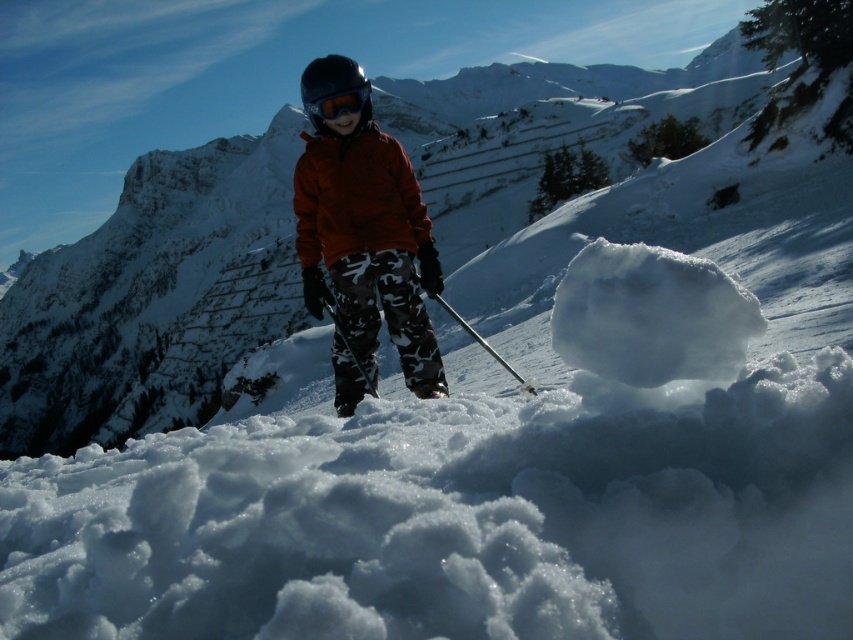
Based on the photo, does matte black goggles at center have a lesser width compared to metallic ski pole at center?

No.

Is point (334, 96) positioned in front of point (521, 381)?

Yes, point (334, 96) is in front of point (521, 381).

This screenshot has height=640, width=853. Find the location of `matte black goggles at center`. matte black goggles at center is located at coordinates (334, 99).

Does orange softshell jacket at center have a larger size compared to metallic ski pole at center?

Indeed, orange softshell jacket at center has a larger size compared to metallic ski pole at center.

Who is shorter, orange softshell jacket at center or metallic ski pole at center?

metallic ski pole at center

Is point (399, 252) farther from camera compared to point (498, 355)?

No, it is not.

Image resolution: width=853 pixels, height=640 pixels. I want to click on orange softshell jacket at center, so click(x=367, y=243).

Can you confirm if orange softshell jacket at center is taller than matte red jacket at center?

Correct, orange softshell jacket at center is much taller as matte red jacket at center.

Which is more to the left, orange softshell jacket at center or matte red jacket at center?

orange softshell jacket at center

Who is more forward, (376, 202) or (426, 236)?

Point (376, 202)

Where is `orange softshell jacket at center`? orange softshell jacket at center is located at coordinates (367, 243).